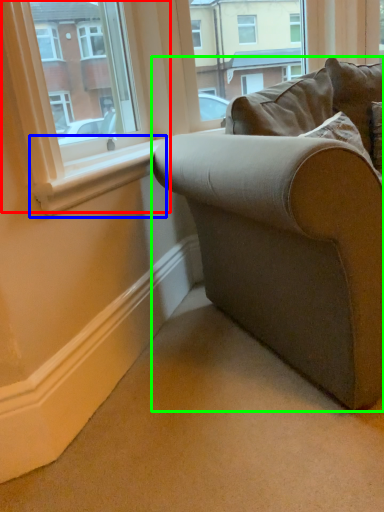
Question: Based on their relative distances, which object is farther from window (highlighted by a red box)? Choose from window sill (highlighted by a blue box) and studio couch (highlighted by a green box).

Choices:
 (A) window sill
 (B) studio couch

Answer: (B)